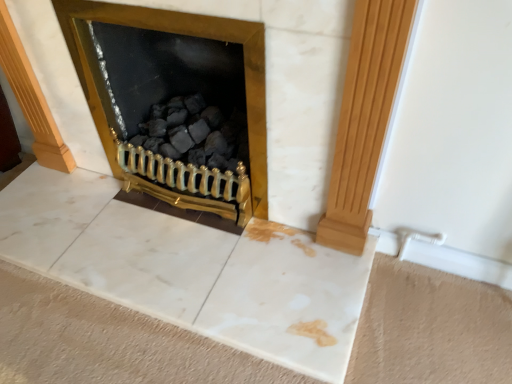
Describe the element at coordinates (170, 87) in the screenshot. I see `gold metallic fireplace at center` at that location.

The width and height of the screenshot is (512, 384). Find the location of `gold metallic fireplace at center`. gold metallic fireplace at center is located at coordinates (170, 87).

This screenshot has height=384, width=512. Find the location of `light brown wood pillar at right`. light brown wood pillar at right is located at coordinates (364, 118).

Describe the element at coordinates (364, 118) in the screenshot. I see `light brown wood pillar at right` at that location.

Locate an element on the screen. gold metallic fireplace at center is located at coordinates 170,87.

Is gold metallic fireplace at center at the left side of light brown wood pillar at right?

Correct, you'll find gold metallic fireplace at center to the left of light brown wood pillar at right.

Which object is closer to the camera, gold metallic fireplace at center or light brown wood pillar at right?

light brown wood pillar at right is more forward.

Is point (259, 180) closer or farther from the camera than point (388, 4)?

Point (259, 180) is positioned farther from the camera compared to point (388, 4).

From the image's perspective, is gold metallic fireplace at center located beneath light brown wood pillar at right?

Actually, gold metallic fireplace at center appears above light brown wood pillar at right in the image.

From a real-world perspective, is gold metallic fireplace at center under light brown wood pillar at right?

Yes, from a real-world perspective, gold metallic fireplace at center is below light brown wood pillar at right.

Can you confirm if gold metallic fireplace at center is wider than light brown wood pillar at right?

Indeed, gold metallic fireplace at center has a greater width compared to light brown wood pillar at right.

Consider the image. Between gold metallic fireplace at center and light brown wood pillar at right, which one has more height?

light brown wood pillar at right is taller.

In terms of size, does gold metallic fireplace at center appear bigger or smaller than light brown wood pillar at right?

In the image, gold metallic fireplace at center appears to be larger than light brown wood pillar at right.

Is gold metallic fireplace at center situated inside light brown wood pillar at right or outside?

The correct answer is: outside.

Are gold metallic fireplace at center and light brown wood pillar at right beside each other?

No, gold metallic fireplace at center is not next to light brown wood pillar at right.

Is gold metallic fireplace at center looking in the opposite direction of light brown wood pillar at right?

No, gold metallic fireplace at center is not facing away from light brown wood pillar at right.

How different are the orientations of gold metallic fireplace at center and light brown wood pillar at right in degrees?

The facing directions of gold metallic fireplace at center and light brown wood pillar at right are 0.637 degrees apart.

Measure the distance from gold metallic fireplace at center to light brown wood pillar at right.

The distance of gold metallic fireplace at center from light brown wood pillar at right is 16.70 inches.

Where is `fireplace located behind the light brown wood pillar at right`? fireplace located behind the light brown wood pillar at right is located at coordinates (170, 87).

Considering the relative positions of light brown wood pillar at right and gold metallic fireplace at center in the image provided, is light brown wood pillar at right to the left or to the right of gold metallic fireplace at center?

Based on their positions, light brown wood pillar at right is located to the right of gold metallic fireplace at center.

Considering their positions, is light brown wood pillar at right located in front of or behind gold metallic fireplace at center?

Visually, light brown wood pillar at right is located in front of gold metallic fireplace at center.

Is point (341, 154) closer or farther from the camera than point (136, 94)?

Clearly, point (341, 154) is closer to the camera than point (136, 94).

From the image's perspective, between light brown wood pillar at right and gold metallic fireplace at center, which one is located above?

gold metallic fireplace at center appears higher in the image.

From a real-world perspective, which object stands above the other?

In real-world perspective, light brown wood pillar at right is above.

Considering the sizes of light brown wood pillar at right and gold metallic fireplace at center in the image, is light brown wood pillar at right wider or thinner than gold metallic fireplace at center?

Clearly, light brown wood pillar at right has less width compared to gold metallic fireplace at center.

Is light brown wood pillar at right shorter than gold metallic fireplace at center?

No.

Based on their sizes in the image, would you say light brown wood pillar at right is bigger or smaller than gold metallic fireplace at center?

In the image, light brown wood pillar at right appears to be smaller than gold metallic fireplace at center.

Does light brown wood pillar at right contain gold metallic fireplace at center?

No.

Is light brown wood pillar at right directly adjacent to gold metallic fireplace at center?

No.

Is light brown wood pillar at right positioned with its back to gold metallic fireplace at center?

light brown wood pillar at right does not have its back to gold metallic fireplace at center.

How many degrees apart are the facing directions of light brown wood pillar at right and gold metallic fireplace at center?

The angular difference between light brown wood pillar at right and gold metallic fireplace at center is 0.637 degrees.

Identify the location of pillar on the right side of gold metallic fireplace at center. (364, 118).

Locate an element on the screen. pillar in front of the gold metallic fireplace at center is located at coordinates (364, 118).

Find the location of a particular element. This screenshot has height=384, width=512. pillar that is below the gold metallic fireplace at center (from the image's perspective) is located at coordinates (364, 118).